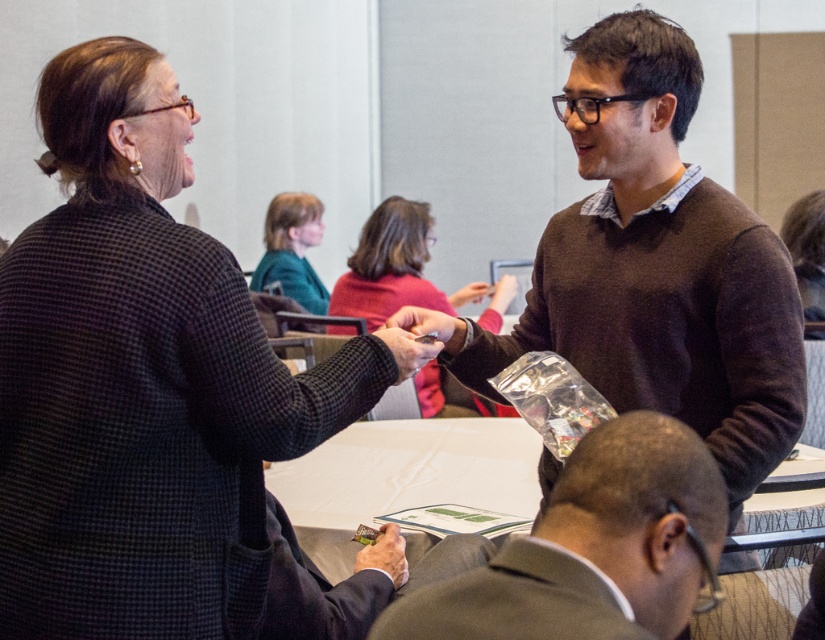
You are an event planner observing the scene. You need to determine the visibility of the two sweaters. Which sweater, the brown sweater at upper right or the matte red sweater at center, is more visible to someone standing at the entrance of the room?

The brown sweater at upper right is more visible because it is in front of the matte red sweater at center.

You are organizing a charity event and need to place a donation box between the matte red sweater at center and the teal fabric jacket at upper center. Which object should the box be closer to if it needs to be placed near the larger item?

The donation box should be placed closer to the matte red sweater at center because it is larger in size than the teal fabric jacket at upper center.

You are an event planner organizing a seating chart for a conference. You need to place a name tag for the person wearing the matte red sweater at center. According to the image, where should you place the name tag in terms of coordinates?

The name tag for the person wearing the matte red sweater at center should be placed at coordinates point (392, 266) as that is where the matte red sweater at center is located.